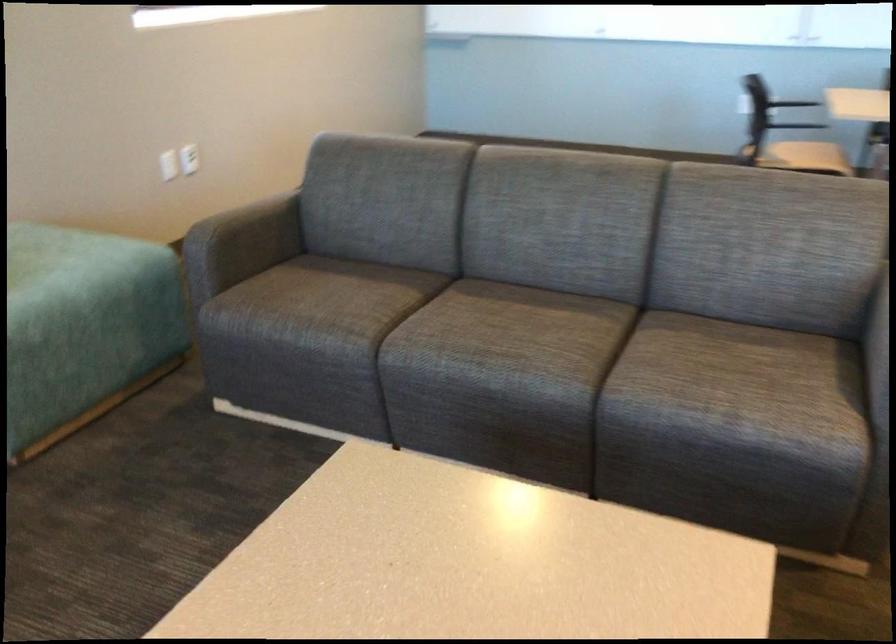
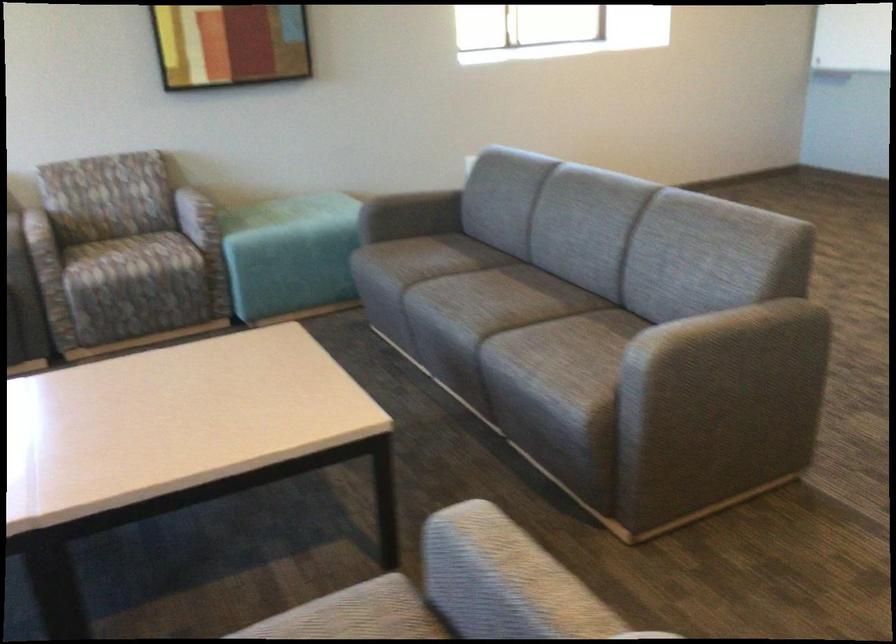
Question: I am providing you with two images of the same scene from different viewpoints. After the viewpoint changes to image2, which objects are now occluded?

Choices:
 (A) patterned chair armrest
 (B) chair sitting surface
 (C) light blue ottoman
 (D) none of these

Answer: (D)